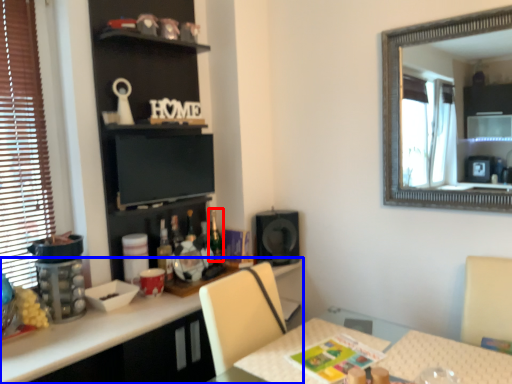
Question: Which object is closer to the camera taking this photo, bottle (highlighted by a red box) or cabinetry (highlighted by a blue box)?

Choices:
 (A) bottle
 (B) cabinetry

Answer: (B)